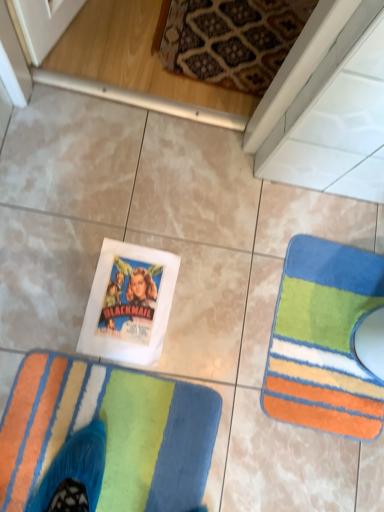
Question: Is multicolored plush rug at lower left, which ranks as the 1th towel in front-to-back order, behind multicolored plush rug at lower right, acting as the 1th towel starting from the right?

Choices:
 (A) no
 (B) yes

Answer: (A)

Question: From a real-world perspective, does multicolored plush rug at lower left, which ranks as the 1th towel in front-to-back order, sit lower than multicolored plush rug at lower right, which appears as the 2th towel when viewed from the front?

Choices:
 (A) yes
 (B) no

Answer: (B)

Question: Can you confirm if multicolored plush rug at lower left, the second towel viewed from the back, is thinner than multicolored plush rug at lower right, acting as the 1th towel starting from the right?

Choices:
 (A) yes
 (B) no

Answer: (B)

Question: Considering the relative sizes of multicolored plush rug at lower left, which is the 2th towel from right to left, and multicolored plush rug at lower right, acting as the 1th towel starting from the right, in the image provided, is multicolored plush rug at lower left, which is the 2th towel from right to left, smaller than multicolored plush rug at lower right, acting as the 1th towel starting from the right,?

Choices:
 (A) no
 (B) yes

Answer: (A)

Question: Is multicolored plush rug at lower right, the first towel in the back-to-front sequence, at the back of multicolored plush rug at lower left, the second towel viewed from the back?

Choices:
 (A) yes
 (B) no

Answer: (B)

Question: Does multicolored plush rug at lower left, which is the 2th towel from right to left, have a greater width compared to multicolored plush rug at lower right, which appears as the 2th towel when viewed from the front?

Choices:
 (A) yes
 (B) no

Answer: (A)

Question: Considering the relative sizes of multicolored plush rug at lower right, the first towel in the back-to-front sequence, and multicolored plush rug at lower left, the second towel viewed from the back, in the image provided, is multicolored plush rug at lower right, the first towel in the back-to-front sequence, thinner than multicolored plush rug at lower left, the second towel viewed from the back,?

Choices:
 (A) yes
 (B) no

Answer: (A)

Question: Is multicolored plush rug at lower right, which appears as the 2th towel when viewed from the left, in front of multicolored plush rug at lower left, which ranks as the 1th towel in front-to-back order?

Choices:
 (A) yes
 (B) no

Answer: (B)

Question: Is multicolored plush rug at lower right, acting as the 1th towel starting from the right, wider than multicolored plush rug at lower left, the second towel viewed from the back?

Choices:
 (A) no
 (B) yes

Answer: (A)

Question: Does multicolored plush rug at lower right, which appears as the 2th towel when viewed from the left, turn towards multicolored plush rug at lower left, the second towel viewed from the back?

Choices:
 (A) yes
 (B) no

Answer: (A)

Question: Can you confirm if multicolored plush rug at lower right, the first towel in the back-to-front sequence, is positioned to the right of multicolored plush rug at lower left, which is the 2th towel from right to left?

Choices:
 (A) yes
 (B) no

Answer: (A)

Question: From a real-world perspective, is multicolored plush rug at lower right, which appears as the 2th towel when viewed from the front, located beneath multicolored plush rug at lower left, which ranks as the 1th towel in front-to-back order?

Choices:
 (A) no
 (B) yes

Answer: (B)

Question: Is multicolored plush rug at lower right, acting as the 1th towel starting from the right, in front of or behind multicolored plush rug at lower left, which is the first towel from left to right, in the image?

Choices:
 (A) front
 (B) behind

Answer: (B)